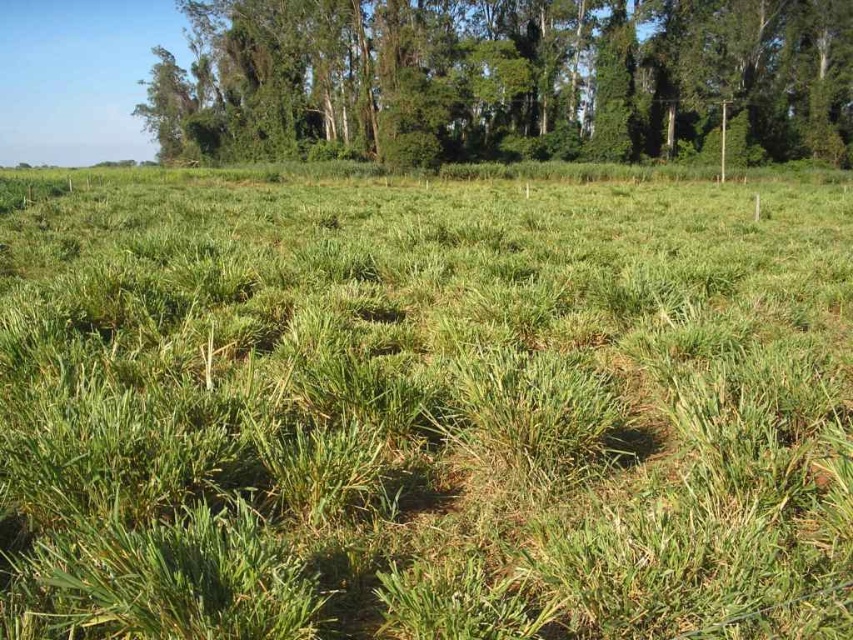
Is green grassy field at center positioned at the back of green leafy trees at upper center?

No.

Is green grassy field at center thinner than green leafy trees at upper center?

Yes.

The width and height of the screenshot is (853, 640). I want to click on green grassy field at center, so [x=422, y=406].

This screenshot has width=853, height=640. I want to click on green grassy field at center, so click(422, 406).